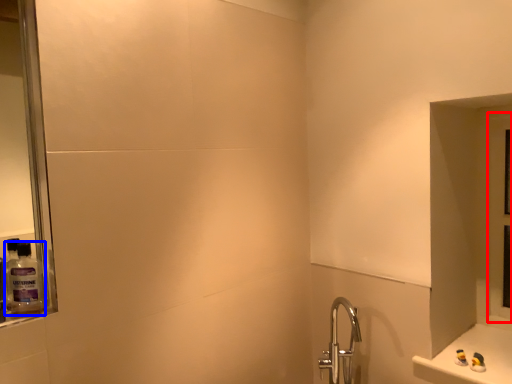
Question: Which object is further to the camera taking this photo, glass door (highlighted by a red box) or mouthwash (highlighted by a blue box)?

Choices:
 (A) glass door
 (B) mouthwash

Answer: (A)